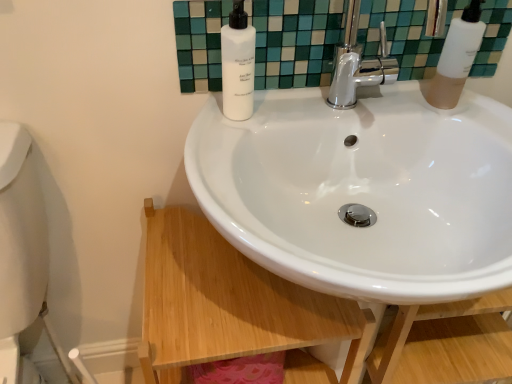
At what (x,y) coordinates should I click in order to perform the action: click on free space that is in between white matte bottle at upper right, arranged as the 2th soap dispenser when viewed from the left, and white matte bottle at upper center, which ranks as the second soap dispenser in right-to-left order. Please return your answer as a coordinate pair (x, y). This screenshot has width=512, height=384. Looking at the image, I should click on (343, 110).